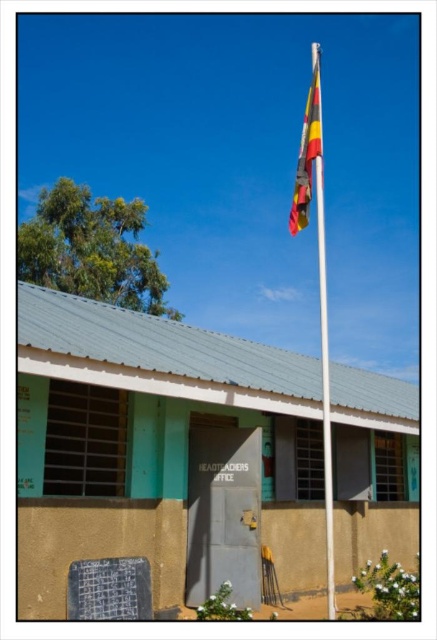
Can you confirm if white plastic flag pole at center is shorter than multicolored fabric flag at center?

No.

Does white plastic flag pole at center have a lesser width compared to multicolored fabric flag at center?

Yes, white plastic flag pole at center is thinner than multicolored fabric flag at center.

Measure the distance between white plastic flag pole at center and camera.

A distance of 7.57 meters exists between white plastic flag pole at center and camera.

What are the coordinates of `white plastic flag pole at center` in the screenshot? It's located at (323, 348).